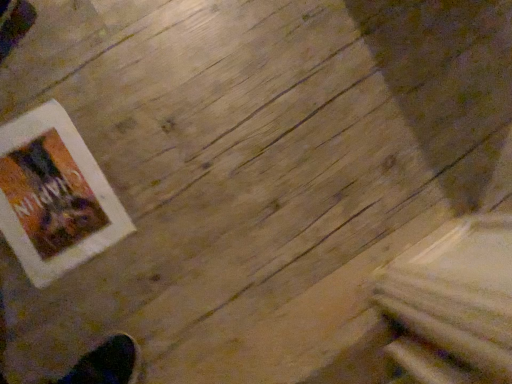
I want to click on free spot behind white matte picture frame at lower left, so click(105, 84).